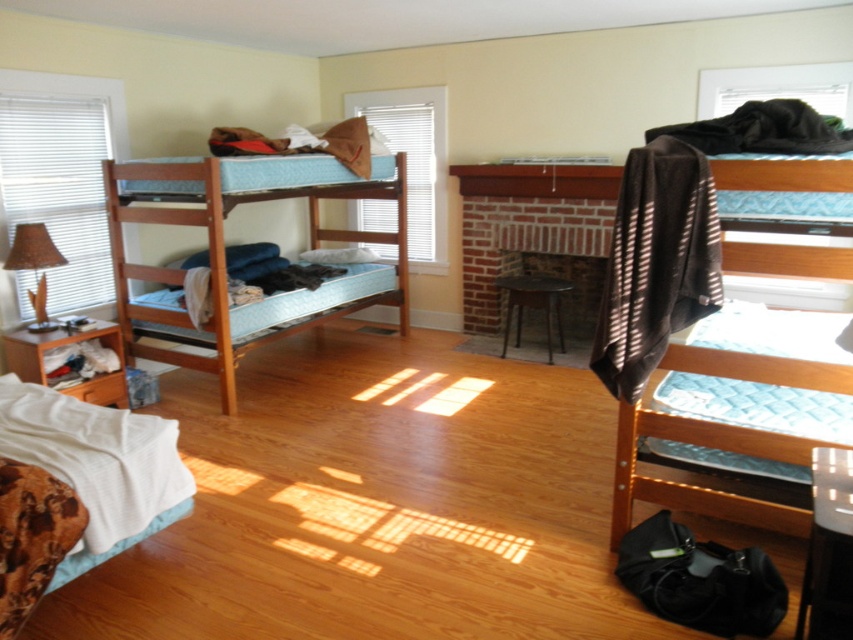
Does wooden bunk bed at left come behind brown wood drawer at lower left?

Yes, it is behind brown wood drawer at lower left.

Does point (223, 186) come farther from viewer compared to point (39, 372)?

Yes, it is.

Who is more forward, (170,211) or (123,348)?

Positioned in front is point (170,211).

I want to click on wooden bunk bed at left, so click(224, 257).

Between brown wood drawer at lower left and brown fabric lampshade at left, which one is positioned lower?

brown wood drawer at lower left is lower down.

Consider the image. Does brown wood drawer at lower left lie in front of brown fabric lampshade at left?

No.

Describe the element at coordinates (61, 348) in the screenshot. I see `brown wood drawer at lower left` at that location.

Find the location of a particular element. Image resolution: width=853 pixels, height=640 pixels. brown wood drawer at lower left is located at coordinates (61, 348).

Who is positioned more to the right, wooden bunk bed at left or brown fabric lampshade at left?

Positioned to the right is wooden bunk bed at left.

Is wooden bunk bed at left bigger than brown fabric lampshade at left?

Correct, wooden bunk bed at left is larger in size than brown fabric lampshade at left.

Who is more distant from viewer, (148, 278) or (35, 253)?

The point (148, 278) is more distant.

Locate an element on the screen. Image resolution: width=853 pixels, height=640 pixels. wooden bunk bed at left is located at coordinates (224, 257).